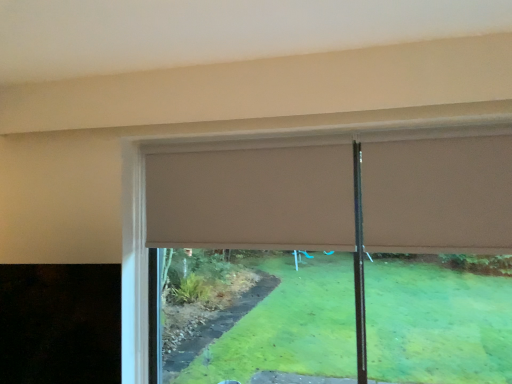
Question: Should I look upward or downward to see beige fabric curtain at upper center, which appears as the first curtain when viewed from the front?

Choices:
 (A) up
 (B) down

Answer: (A)

Question: Is beige fabric curtain at upper center, the first curtain from the left, further to camera compared to beige fabric curtain at upper center, placed as the 2th curtain when sorted from left to right?

Choices:
 (A) yes
 (B) no

Answer: (A)

Question: Is beige fabric curtain at upper center, which ranks as the second curtain in front-to-back order, facing towards beige fabric curtain at upper center, the first curtain positioned from the right?

Choices:
 (A) yes
 (B) no

Answer: (B)

Question: From a real-world perspective, does beige fabric curtain at upper center, which ranks as the second curtain in front-to-back order, stand above beige fabric curtain at upper center, the first curtain positioned from the right?

Choices:
 (A) no
 (B) yes

Answer: (A)

Question: Would you say beige fabric curtain at upper center, the second curtain when ordered from right to left, is a long distance from beige fabric curtain at upper center, placed as the 2th curtain when sorted from left to right?

Choices:
 (A) no
 (B) yes

Answer: (A)

Question: Is beige fabric curtain at upper center, the second curtain when ordered from right to left, thinner than beige fabric curtain at upper center, placed as the 2th curtain when sorted from left to right?

Choices:
 (A) yes
 (B) no

Answer: (A)

Question: Is beige fabric curtain at upper center, the second curtain when ordered from right to left, shorter than beige fabric curtain at upper center, which appears as the first curtain when viewed from the front?

Choices:
 (A) no
 (B) yes

Answer: (A)

Question: Does beige fabric curtain at upper center, which appears as the first curtain when viewed from the front, turn towards beige fabric curtain at upper center, which is counted as the first curtain, starting from the back?

Choices:
 (A) no
 (B) yes

Answer: (A)

Question: From a real-world perspective, is beige fabric curtain at upper center, placed as the 2th curtain when sorted from left to right, under beige fabric curtain at upper center, which is counted as the first curtain, starting from the back?

Choices:
 (A) yes
 (B) no

Answer: (B)

Question: Does beige fabric curtain at upper center, placed as the 2th curtain when sorted from left to right, have a lesser width compared to beige fabric curtain at upper center, the second curtain when ordered from right to left?

Choices:
 (A) yes
 (B) no

Answer: (B)

Question: Are beige fabric curtain at upper center, which appears as the first curtain when viewed from the front, and beige fabric curtain at upper center, which ranks as the second curtain in front-to-back order, making contact?

Choices:
 (A) no
 (B) yes

Answer: (A)

Question: Is beige fabric curtain at upper center, which ranks as the 2th curtain in back-to-front order, oriented away from beige fabric curtain at upper center, which ranks as the second curtain in front-to-back order?

Choices:
 (A) yes
 (B) no

Answer: (B)

Question: Considering the relative sizes of beige fabric curtain at upper center, which ranks as the 2th curtain in back-to-front order, and beige fabric curtain at upper center, the first curtain from the left, in the image provided, is beige fabric curtain at upper center, which ranks as the 2th curtain in back-to-front order, shorter than beige fabric curtain at upper center, the first curtain from the left,?

Choices:
 (A) yes
 (B) no

Answer: (A)

Question: Is beige fabric curtain at upper center, the first curtain from the left, taller or shorter than beige fabric curtain at upper center, placed as the 2th curtain when sorted from left to right?

Choices:
 (A) short
 (B) tall

Answer: (B)